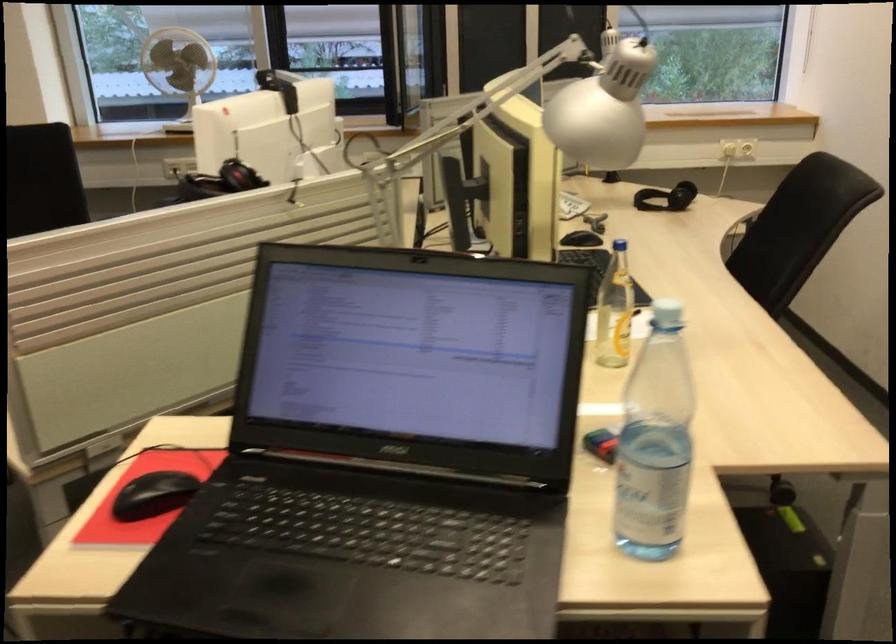
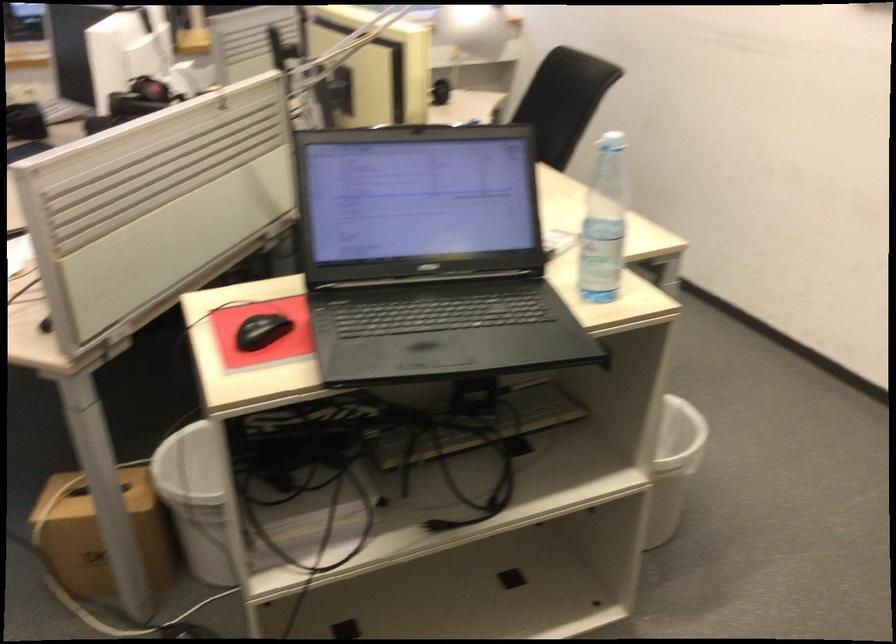
Find the pixel in the second image that matches (x=147, y=496) in the first image.

(261, 330)